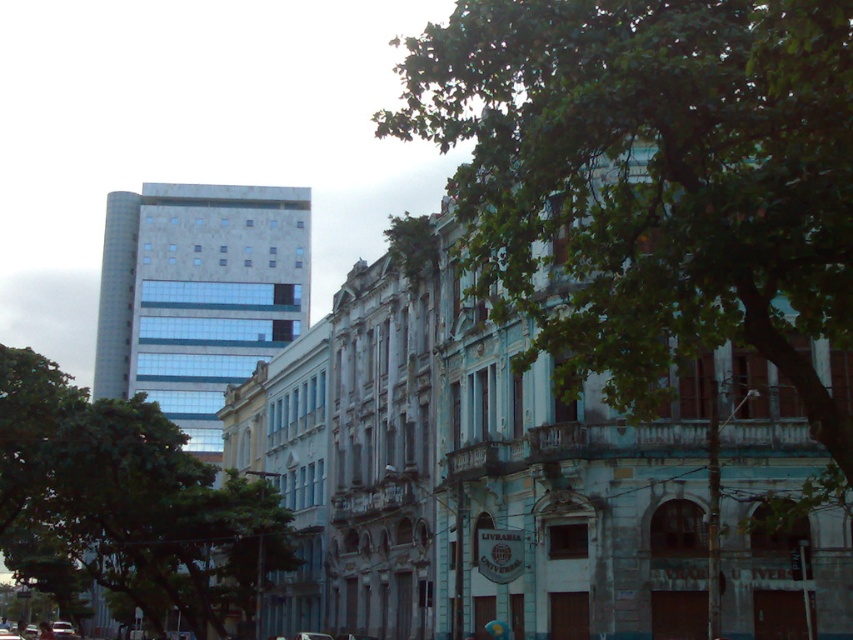
Does point (485, 88) lie behind point (0, 468)?

No, (485, 88) is in front of (0, 468).

Who is positioned more to the left, green leafy tree at center or green leafy tree at left?

green leafy tree at left is more to the left.

You are a GUI agent. You are given a task and a screenshot of the screen. Output one action in this format:
    pyautogui.click(x=<x>, y=<y>)
    Task: Click on the green leafy tree at center
    
    Given the screenshot: What is the action you would take?
    pyautogui.click(x=650, y=180)

Locate an element on the screen. This screenshot has width=853, height=640. green leafy tree at left is located at coordinates (125, 502).

Does green leafy tree at left appear on the left side of metallic silver car at lower left?

No, green leafy tree at left is not to the left of metallic silver car at lower left.

This screenshot has height=640, width=853. Describe the element at coordinates (125, 502) in the screenshot. I see `green leafy tree at left` at that location.

You are a GUI agent. You are given a task and a screenshot of the screen. Output one action in this format:
    pyautogui.click(x=<x>, y=<y>)
    Task: Click on the green leafy tree at left
    This screenshot has height=640, width=853.
    Given the screenshot: What is the action you would take?
    pyautogui.click(x=125, y=502)

Can you confirm if green leafy tree at center is smaller than metallic silver car at lower left?

Actually, green leafy tree at center might be larger than metallic silver car at lower left.

Does point (595, 150) come closer to viewer compared to point (57, 636)?

That is True.

Is point (845, 253) positioned behind point (57, 621)?

No, (845, 253) is in front of (57, 621).

Locate an element on the screen. The height and width of the screenshot is (640, 853). green leafy tree at center is located at coordinates [x=650, y=180].